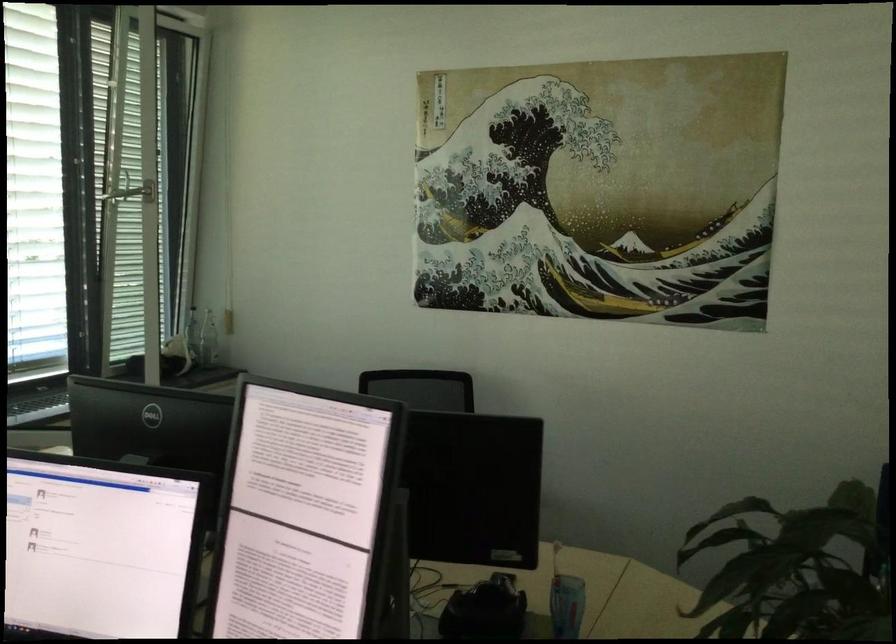
Find the location of a particular element. This screenshot has height=644, width=896. silver door handle is located at coordinates (x=133, y=193).